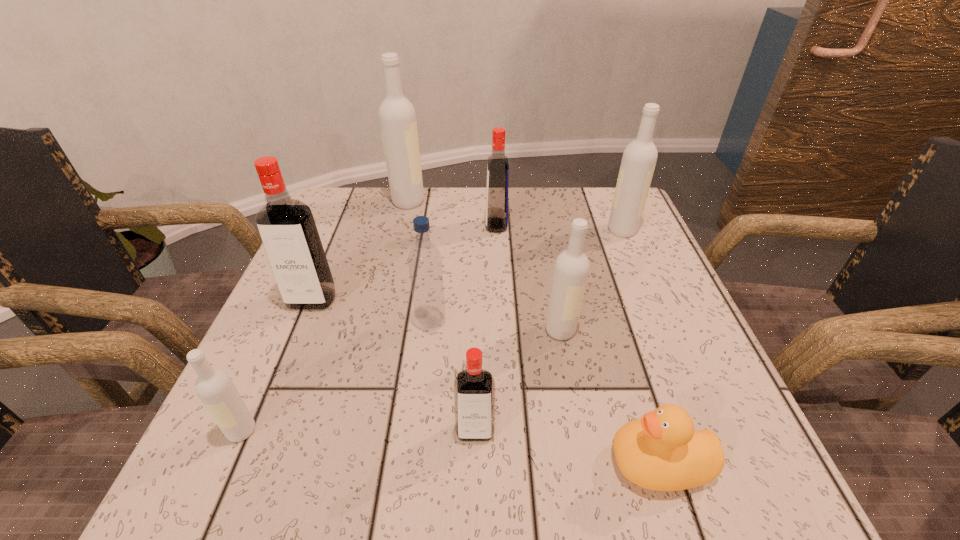
The width and height of the screenshot is (960, 540). In order to click on blank space located 0.350m on the front and back of the farthest red vodka in this screenshot , I will do coord(342,225).

This screenshot has height=540, width=960. Find the location of `blank space located on the front and back of the farthest red vodka`. blank space located on the front and back of the farthest red vodka is located at coordinates (337, 225).

The height and width of the screenshot is (540, 960). I want to click on vacant region located 0.080m on the back of the third object from right to left, so click(x=553, y=291).

Find the location of `free location located on the front of the sixth object from right to left`. free location located on the front of the sixth object from right to left is located at coordinates (421, 410).

The image size is (960, 540). Find the location of `vacant space located on the right of the nearest white vodka`. vacant space located on the right of the nearest white vodka is located at coordinates (396, 431).

Locate an element on the screen. vacant space located 0.290m on the face of the shortest object is located at coordinates (407, 463).

In order to click on free space located on the face of the shortest object in this screenshot , I will do `click(463, 463)`.

Image resolution: width=960 pixels, height=540 pixels. I want to click on free location located on the face of the shortest object, so click(x=527, y=463).

Locate an element on the screen. This screenshot has width=960, height=540. duck that is positioned at the near edge is located at coordinates (661, 451).

I want to click on vodka that is at the right edge, so [x=639, y=159].